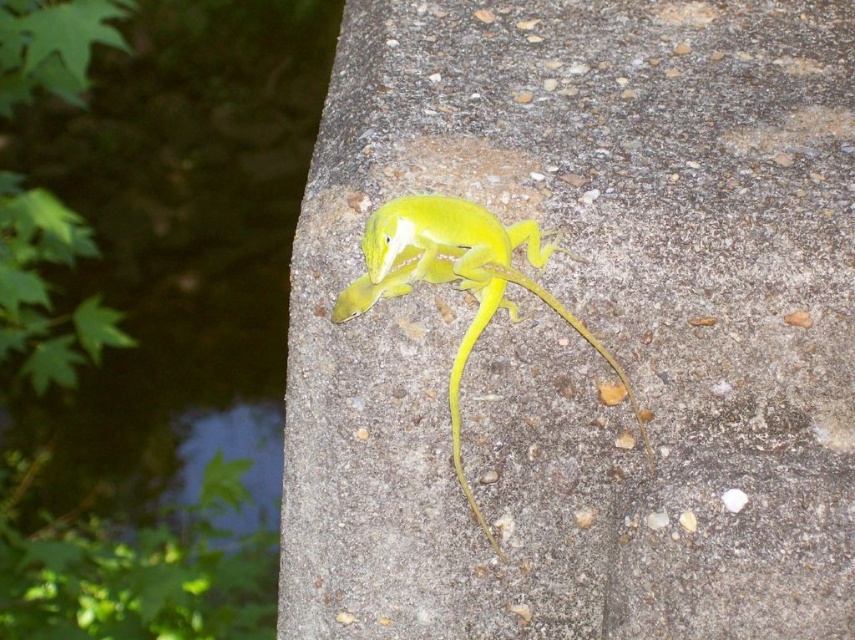
Which is in front, point (422, 502) or point (529, 225)?

Point (529, 225)

Is smooth concrete at center taller than green matte lizard at center?

Yes.

Describe the element at coordinates (585, 324) in the screenshot. I see `smooth concrete at center` at that location.

The width and height of the screenshot is (855, 640). Identify the location of smooth concrete at center. coord(585,324).